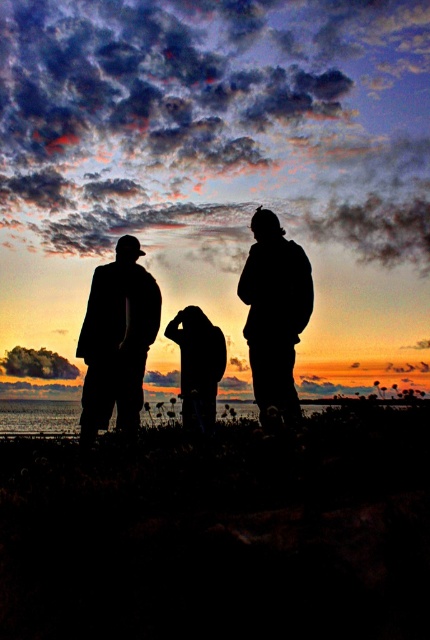
Can you confirm if grassy beach at lower center is positioned above silhouette suit at left?

No.

Is point (420, 548) in front of point (119, 372)?

Yes, point (420, 548) is in front of point (119, 372).

Describe the element at coordinates (221, 532) in the screenshot. Image resolution: width=430 pixels, height=640 pixels. I see `grassy beach at lower center` at that location.

You are a GUI agent. You are given a task and a screenshot of the screen. Output one action in this format:
    pyautogui.click(x=<x>, y=<y>)
    Task: Click on the grassy beach at lower center
    The width and height of the screenshot is (430, 640).
    Given the screenshot: What is the action you would take?
    pyautogui.click(x=221, y=532)

Describe the element at coordinates (116, 340) in the screenshot. I see `silhouette suit at left` at that location.

Does silhouette suit at left have a lesser width compared to silhouette jacket at right?

In fact, silhouette suit at left might be wider than silhouette jacket at right.

Is point (95, 316) in front of point (255, 262)?

No, it is behind (255, 262).

Image resolution: width=430 pixels, height=640 pixels. Find the location of `silhouette suit at left`. silhouette suit at left is located at coordinates (116, 340).

Between grassy beach at lower center and silhouette jacket at right, which one has less height?

grassy beach at lower center

Which of these two, grassy beach at lower center or silhouette jacket at right, stands taller?

With more height is silhouette jacket at right.

This screenshot has width=430, height=640. Describe the element at coordinates (221, 532) in the screenshot. I see `grassy beach at lower center` at that location.

Where is `grassy beach at lower center`? The image size is (430, 640). grassy beach at lower center is located at coordinates (221, 532).